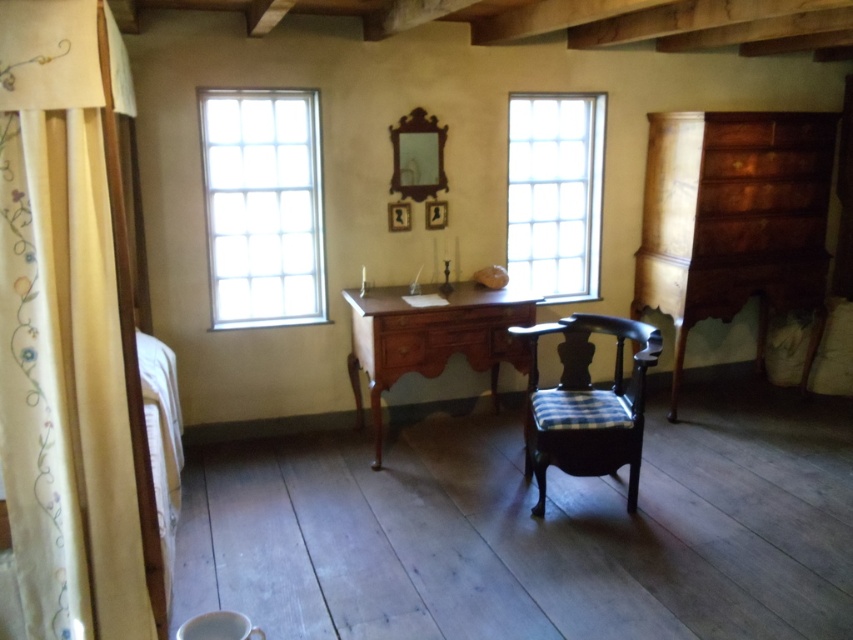
You are standing in the center of the room and want to move towards the two points marked in the scene. Which point, point (804, 186) or point (521, 348), is closer to you?

Point (804, 186) is closer to you because it is further to the viewer than point (521, 348).

You are standing in the center of the room and want to place a new decorative item on the floor near the embroidered cotton curtain at left. Based on its current position, what are the coordinates where you should place the item?

The embroidered cotton curtain at left is located at point (64, 330), so you should place the decorative item near these coordinates on the floor.